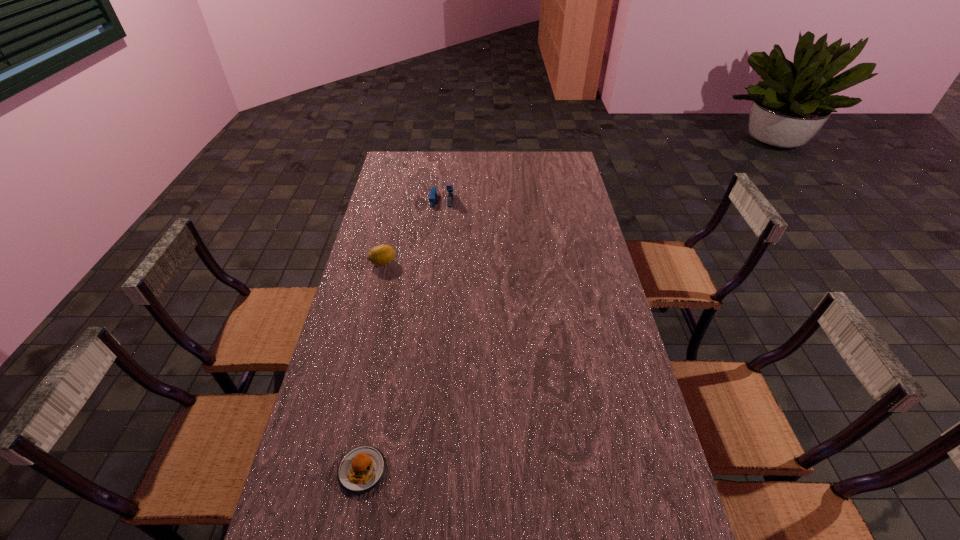
Identify the location of vacant point that satisfies the following two spatial constraints: 1. at the stem end of the second shortest object; 2. on the back side of the shortest object. (333, 470).

Find the location of a particular element. free spot that satisfies the following two spatial constraints: 1. at the stem end of the lemon; 2. on the left side of the shortest object is located at coordinates (333, 470).